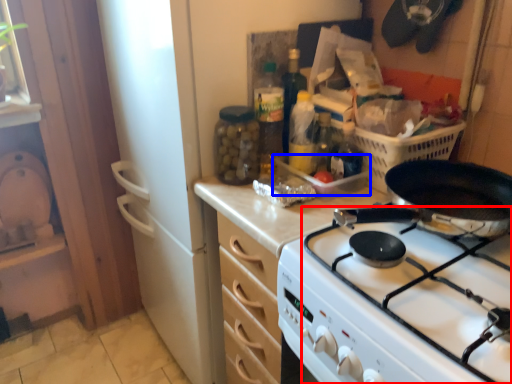
Question: Which object is further to the camera taking this photo, gas stove (highlighted by a red box) or appliance (highlighted by a blue box)?

Choices:
 (A) gas stove
 (B) appliance

Answer: (B)